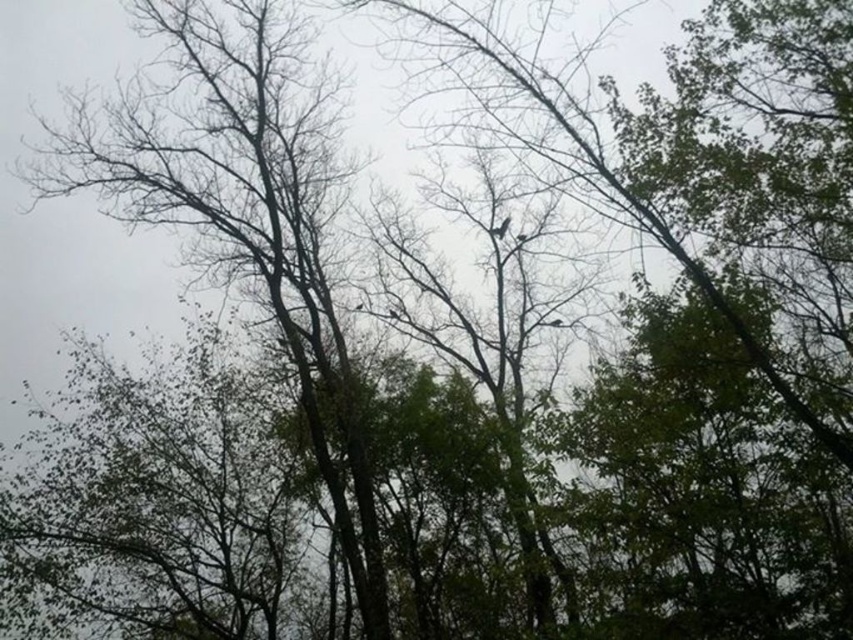
You are a bird looking for a place to perch. You see the bare branches at center. Where exactly would you find them?

The bare branches at center are located at point (238, 205).

You are a bird watcher observing the scene. You notice the bare branches at center and the dark brown feathered bird at center. Which object has a narrower width?

The bare branches at center has a lesser width compared to the dark brown feathered bird at center.

You are a birdwatcher observing the scene. You notice the bare branches at center and the dark brown feathered bird at center. Which object is located to the left of the other?

The bare branches at center is positioned on the left side of dark brown feathered bird at center.